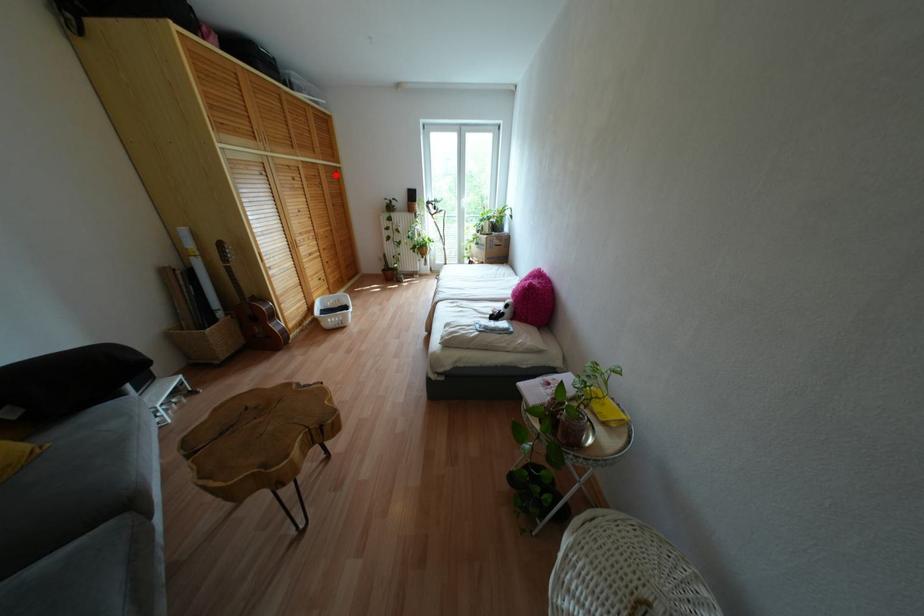
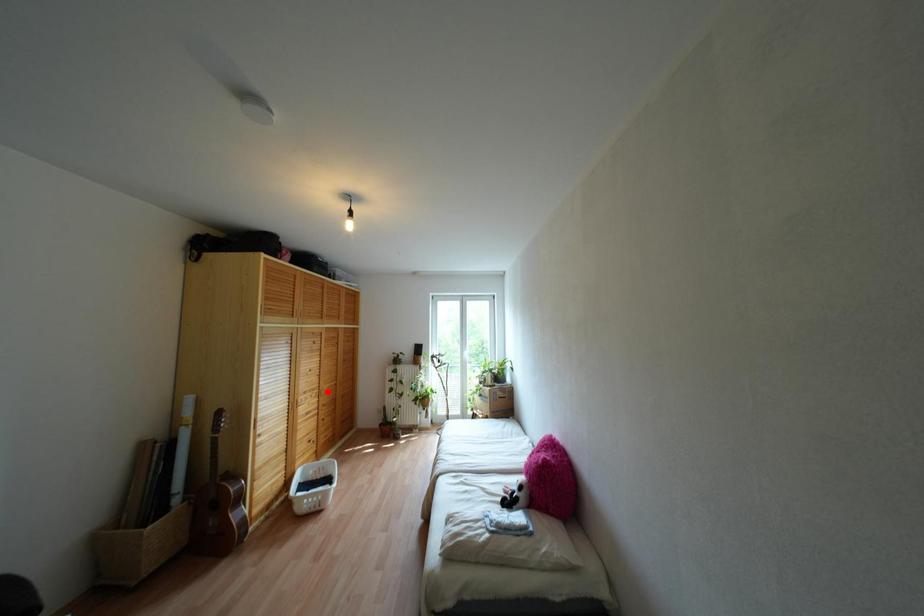
I am providing you with two images of the same scene from different viewpoints. A red point is marked on the first image and another point is marked on the second image. Are the points marked in image1 and image2 representing the same 3D position?

No